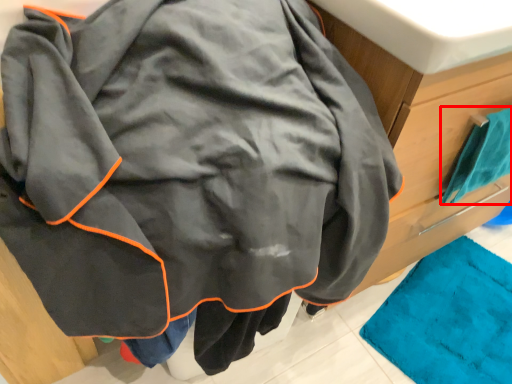
Question: From the image, what is the correct spatial relationship of towel (annotated by the red box) in relation to sink?

Choices:
 (A) right
 (B) left

Answer: (A)